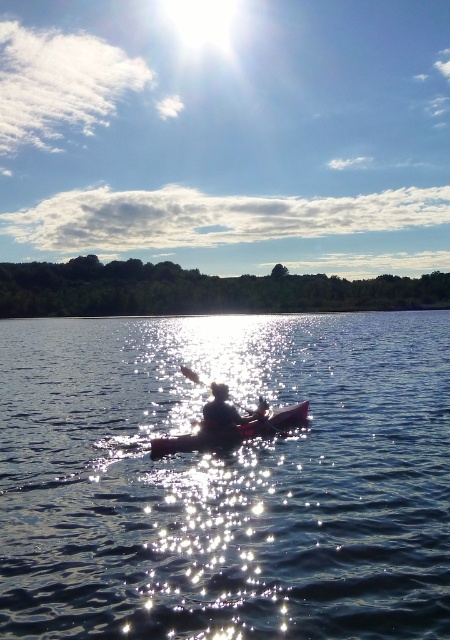
You are a photographer trying to capture the silhouette fabric person at center and the glistening water at center in a single shot. The camera you are using has a maximum focus range of 10 meters. Can you focus on both subjects simultaneously?

The glistening water at center is 11.42 meters from silhouette fabric person at center. Since the camera can only focus up to 10 meters, it cannot focus on both subjects at the same time because the distance between them exceeds the maximum focus range.

You are a photographer trying to capture the kayaker in the image. You want to ensure the pink plastic kayak at center and the wooden paddle at center are both visible in your shot. Which object will require a wider angle to fully capture in the frame?

The pink plastic kayak at center has a greater width than the wooden paddle at center, so it will require a wider angle to fully capture in the frame.